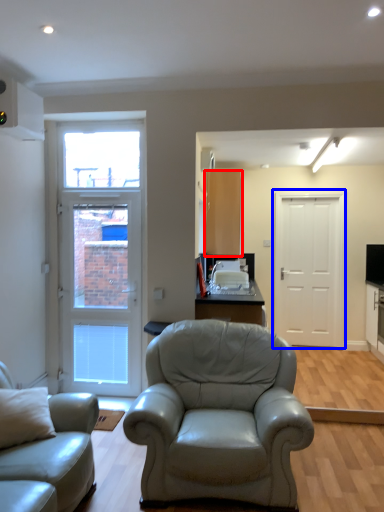
Question: Which of the following is the closest to the observer, cabinetry (highlighted by a red box) or door (highlighted by a blue box)?

Choices:
 (A) cabinetry
 (B) door

Answer: (A)